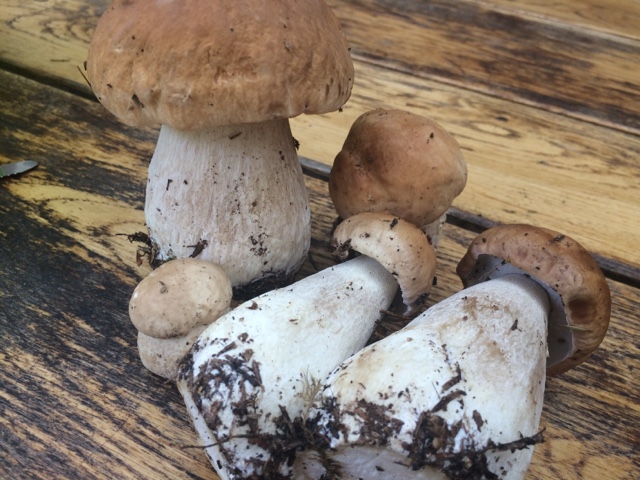
Where is `dirty table`? dirty table is located at coordinates (82, 320).